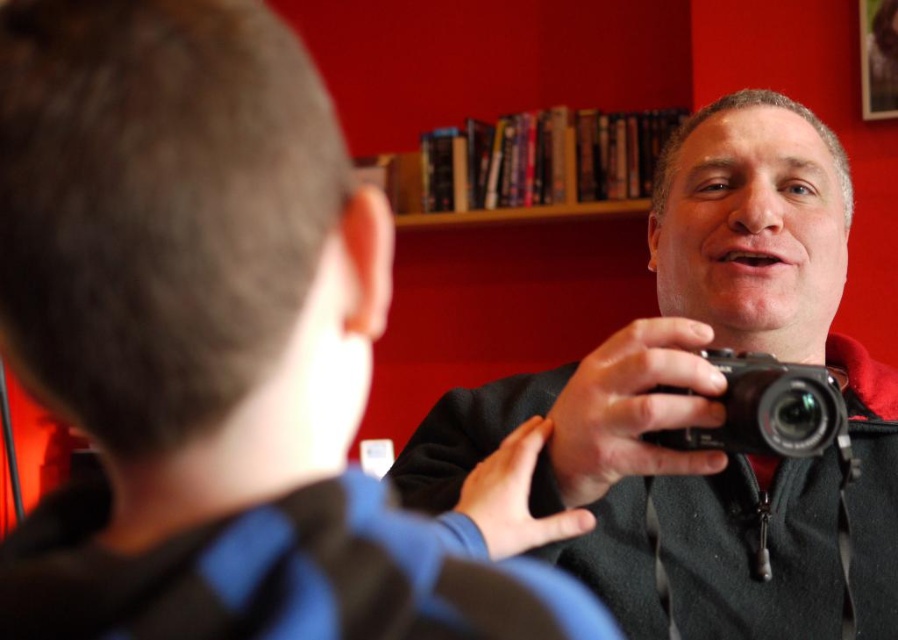
Question: Estimate the real-world distances between objects in this image. Which object is closer to the wooden bookshelf at center?

Choices:
 (A) black plastic camera at center
 (B) black matte camera at center

Answer: (B)

Question: Based on their relative distances, which object is nearer to the black matte camera at center?

Choices:
 (A) black plastic camera at center
 (B) wooden bookshelf at center
 (C) smooth blue shirt at center

Answer: (A)

Question: Can you confirm if black matte camera at center is positioned to the left of black plastic camera at center?

Choices:
 (A) yes
 (B) no

Answer: (B)

Question: Estimate the real-world distances between objects in this image. Which object is closer to the black plastic camera at center?

Choices:
 (A) wooden bookshelf at center
 (B) smooth blue shirt at center

Answer: (B)

Question: Does wooden bookshelf at center lie behind black plastic camera at center?

Choices:
 (A) yes
 (B) no

Answer: (A)

Question: Where is wooden bookshelf at center located in relation to black plastic camera at center in the image?

Choices:
 (A) above
 (B) below

Answer: (A)